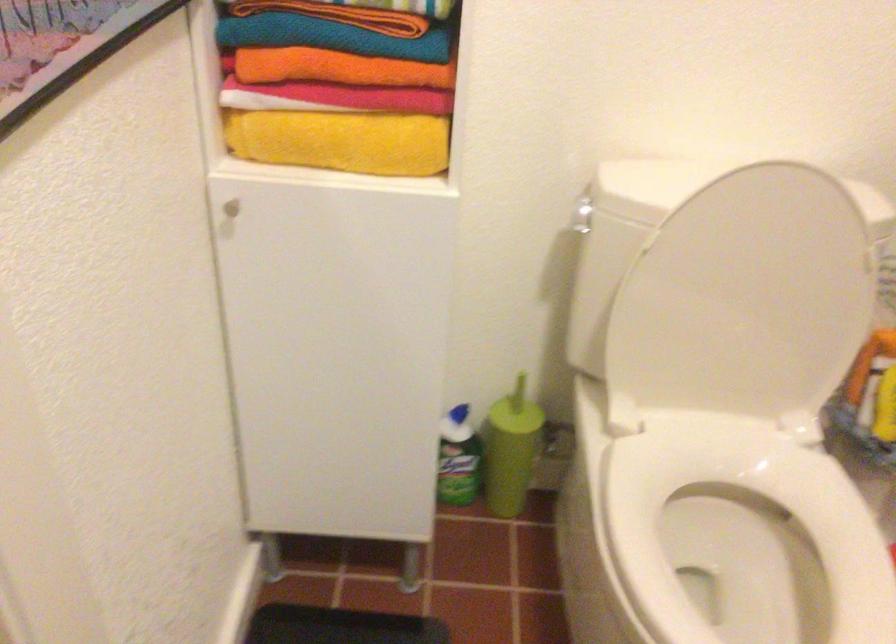
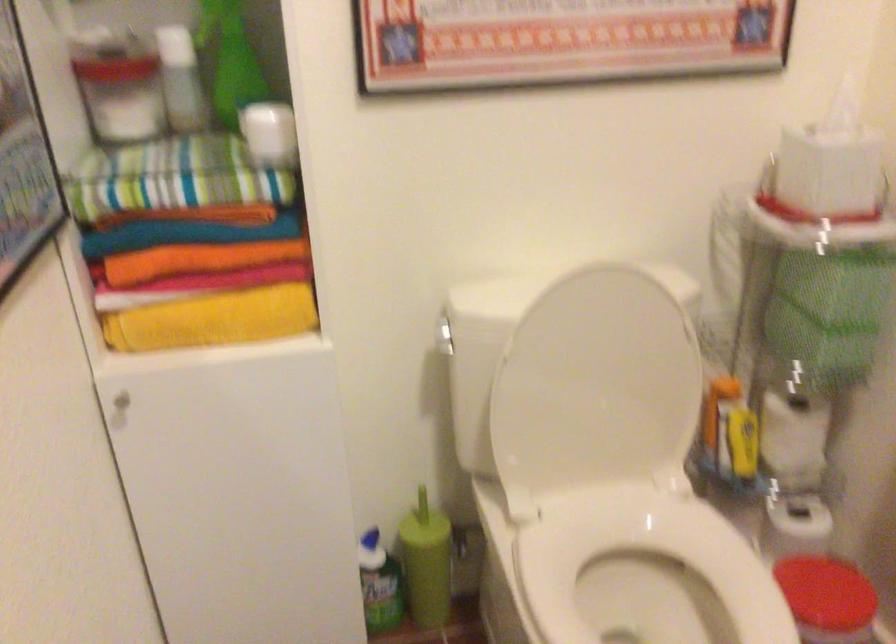
Where in the second image is the point corresponding to the point at 507,451 from the first image?

(426, 563)